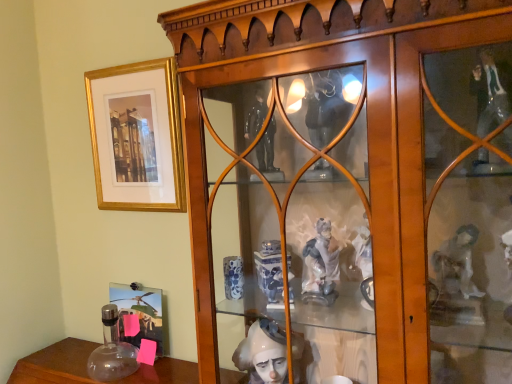
Question: Is metallic silver photo frame at lower left, the first picture frame when ordered from bottom to top, facing towards wooden cabinet at center?

Choices:
 (A) yes
 (B) no

Answer: (B)

Question: Does metallic silver photo frame at lower left, marked as the 2th picture frame in a top-to-bottom arrangement, have a smaller size compared to wooden cabinet at center?

Choices:
 (A) yes
 (B) no

Answer: (A)

Question: From the image's perspective, would you say metallic silver photo frame at lower left, marked as the 2th picture frame in a top-to-bottom arrangement, is shown under wooden cabinet at center?

Choices:
 (A) yes
 (B) no

Answer: (A)

Question: Is metallic silver photo frame at lower left, the first picture frame when ordered from bottom to top, directly adjacent to wooden cabinet at center?

Choices:
 (A) yes
 (B) no

Answer: (B)

Question: Looking at their shapes, would you say gold/matte picture frame at upper left, acting as the second picture frame starting from the bottom, is wider or thinner than wooden cabinet at center?

Choices:
 (A) thin
 (B) wide

Answer: (A)

Question: Does point (165, 150) appear closer or farther from the camera than point (188, 177)?

Choices:
 (A) closer
 (B) farther

Answer: (B)

Question: In terms of size, does gold/matte picture frame at upper left, which ranks as the first picture frame in top-to-bottom order, appear bigger or smaller than wooden cabinet at center?

Choices:
 (A) big
 (B) small

Answer: (B)

Question: From the image's perspective, is gold/matte picture frame at upper left, which ranks as the first picture frame in top-to-bottom order, positioned above or below wooden cabinet at center?

Choices:
 (A) above
 (B) below

Answer: (A)

Question: Considering the positions of gold/matte picture frame at upper left, acting as the second picture frame starting from the bottom, and metallic silver photo frame at lower left, the first picture frame when ordered from bottom to top, in the image, is gold/matte picture frame at upper left, acting as the second picture frame starting from the bottom, taller or shorter than metallic silver photo frame at lower left, the first picture frame when ordered from bottom to top,?

Choices:
 (A) short
 (B) tall

Answer: (B)

Question: From a real-world perspective, is gold/matte picture frame at upper left, which ranks as the first picture frame in top-to-bottom order, physically located above or below metallic silver photo frame at lower left, the first picture frame when ordered from bottom to top?

Choices:
 (A) above
 (B) below

Answer: (A)

Question: From the image's perspective, is gold/matte picture frame at upper left, acting as the second picture frame starting from the bottom, above or below metallic silver photo frame at lower left, marked as the 2th picture frame in a top-to-bottom arrangement?

Choices:
 (A) above
 (B) below

Answer: (A)

Question: In the image, is gold/matte picture frame at upper left, which ranks as the first picture frame in top-to-bottom order, positioned in front of or behind metallic silver photo frame at lower left, the first picture frame when ordered from bottom to top?

Choices:
 (A) front
 (B) behind

Answer: (A)

Question: From a real-world perspective, is wooden cabinet at center above or below gold/matte picture frame at upper left, which ranks as the first picture frame in top-to-bottom order?

Choices:
 (A) above
 (B) below

Answer: (B)

Question: Is wooden cabinet at center to the left or to the right of gold/matte picture frame at upper left, which ranks as the first picture frame in top-to-bottom order, in the image?

Choices:
 (A) left
 (B) right

Answer: (B)